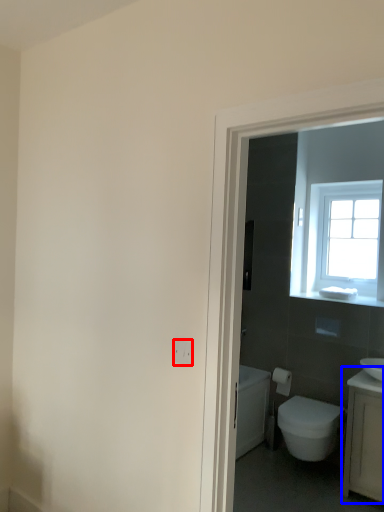
Question: Which point is closer to the camera, electric outlet (highlighted by a red box) or counter top (highlighted by a blue box)?

Choices:
 (A) electric outlet
 (B) counter top

Answer: (A)